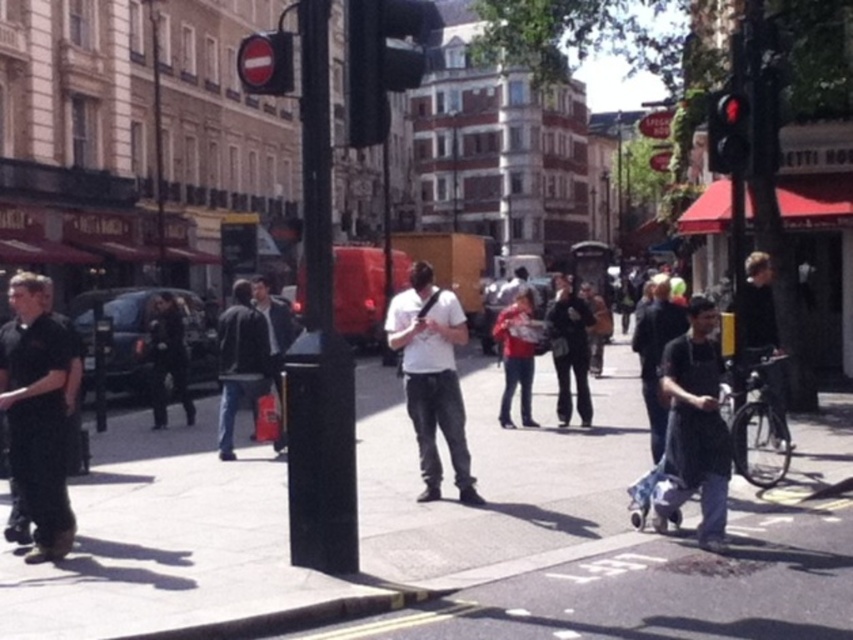
You are a delivery person who needs to deliver a package to the person wearing the black matte shirt at left. The package can only be given to them if they are standing directly behind the dark blue jeans at center. Based on the scene description, can you deliver the package?

The black matte shirt at left is positioned under dark blue jeans at center, meaning the person wearing the black matte shirt at left is standing behind the dark blue jeans at center. Therefore, you can safely deliver the package.

Consider the image. You are a city planner designing a new pedestrian path. The black metal pole at center is located at coordinates 0.539, 0.375. If you want to place a new bench 2 meters away from the pole in the direction facing the street, where should the bench be placed?

The bench should be placed 2 meters away from the black metal pole at center in the direction facing the street, at coordinates calculated based on the pole position.